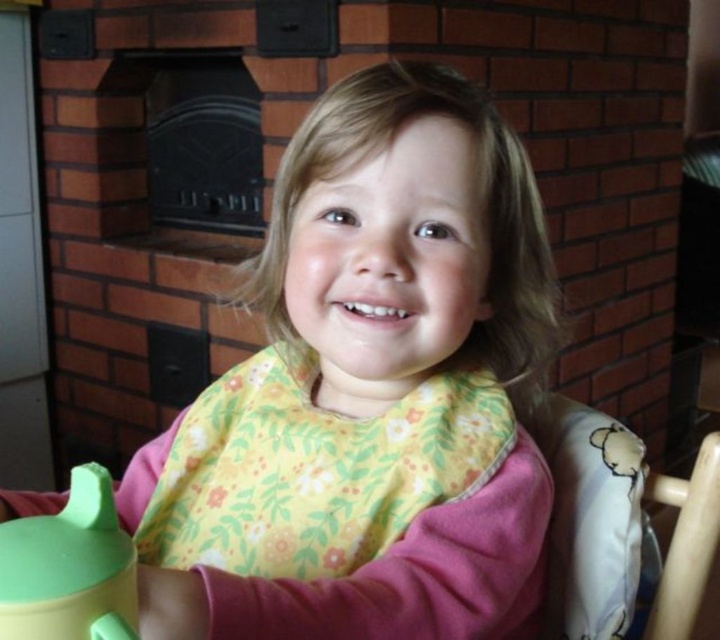
Question: Can you confirm if pink fabric bib at center is positioned to the right of wooden chair at right?

Choices:
 (A) no
 (B) yes

Answer: (A)

Question: Does wooden chair at right appear on the left side of green rubber tea pot at lower left?

Choices:
 (A) yes
 (B) no

Answer: (B)

Question: Among these objects, which one is farthest from the camera?

Choices:
 (A) pink fabric bib at center
 (B) wooden chair at right
 (C) green rubber tea pot at lower left

Answer: (B)

Question: Which of the following is the farthest from the observer?

Choices:
 (A) (679, 536)
 (B) (78, 465)
 (C) (289, 330)

Answer: (B)

Question: Does wooden chair at right appear under green rubber tea pot at lower left?

Choices:
 (A) no
 (B) yes

Answer: (B)

Question: Which is farther from the wooden chair at right?

Choices:
 (A) green rubber tea pot at lower left
 (B) pink fabric bib at center

Answer: (A)